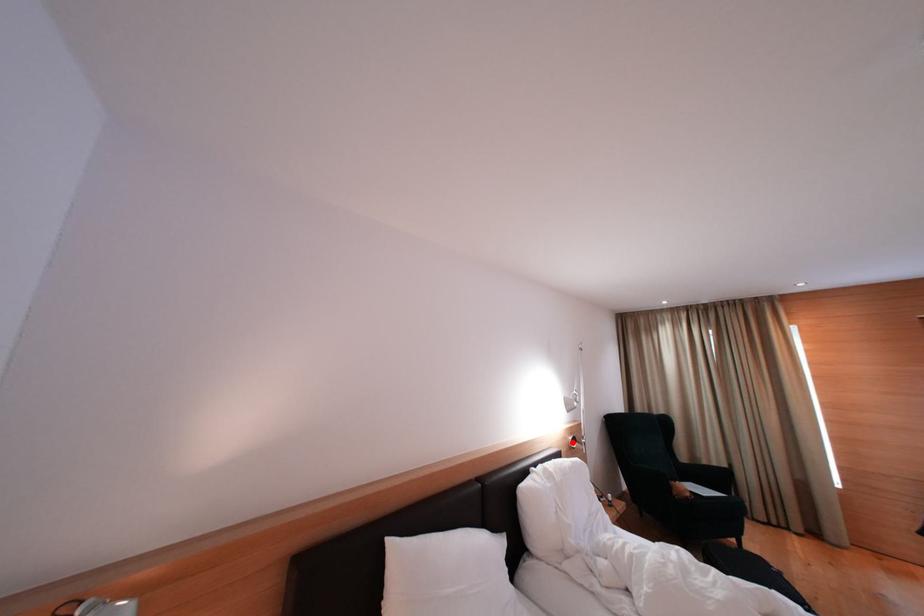
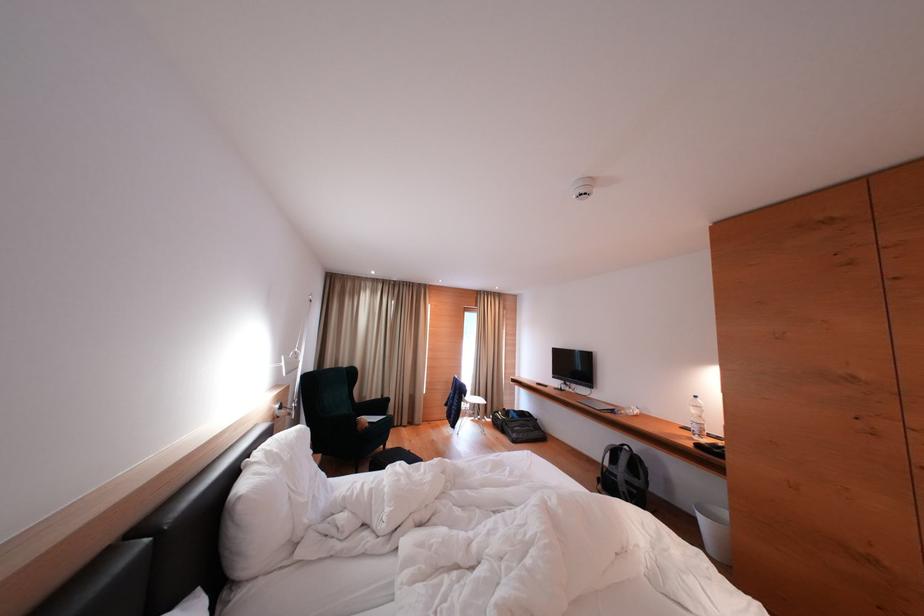
Question: I am providing you with two images of the same scene from different viewpoints. Image1 has a red point marked. In image2, the corresponding 3D location appears at what relative position? Reply with the corresponding letter.

Choices:
 (A) Closer
 (B) Farther

Answer: (A)